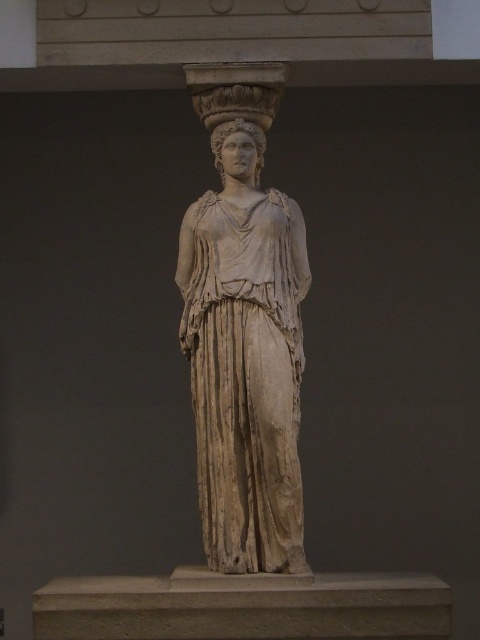
Question: Can you confirm if beige stone statue at center is wider than smooth white head at center?

Choices:
 (A) yes
 (B) no

Answer: (A)

Question: Which of the following is the closest to the observer?

Choices:
 (A) (218, 406)
 (B) (256, 170)

Answer: (A)

Question: Which object is closer to the camera taking this photo?

Choices:
 (A) smooth white head at center
 (B) beige stone statue at center

Answer: (B)

Question: Is beige stone statue at center wider than smooth white head at center?

Choices:
 (A) yes
 (B) no

Answer: (A)

Question: Does beige stone statue at center appear over smooth white head at center?

Choices:
 (A) no
 (B) yes

Answer: (A)

Question: Which point is closer to the camera?

Choices:
 (A) (236, 129)
 (B) (244, 552)

Answer: (B)